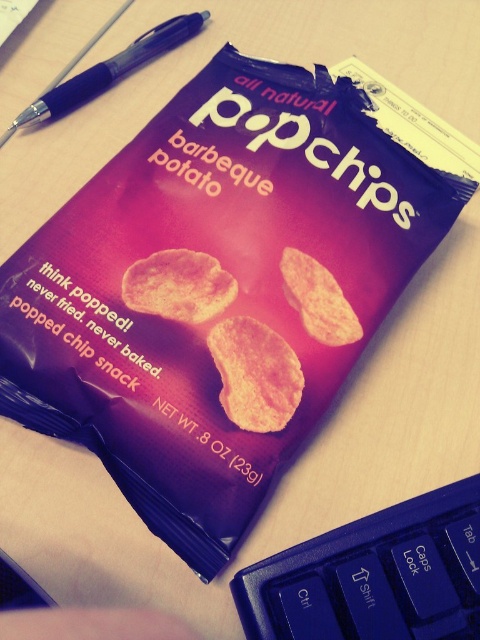
Question: Can you confirm if blue plastic keyboard at bottom right is bigger than black plastic pen at upper left?

Choices:
 (A) no
 (B) yes

Answer: (A)

Question: Is matte orange chip at center wider than black plastic pen at upper left?

Choices:
 (A) yes
 (B) no

Answer: (B)

Question: Is blue plastic keyboard at bottom right wider than matte orange popchip at center?

Choices:
 (A) yes
 (B) no

Answer: (A)

Question: Based on their relative distances, which object is nearer to the matte orange popchip at center?

Choices:
 (A) yellow matte popchip at center
 (B) black plastic pen at upper left
 (C) blue plastic keyboard at bottom right
 (D) matte orange chip at center

Answer: (A)

Question: Among these points, which one is farthest from the camera?

Choices:
 (A) (48, 92)
 (B) (308, 294)
 (C) (251, 424)

Answer: (A)

Question: Considering the real-world distances, which object is farthest from the black plastic pen at upper left?

Choices:
 (A) matte orange popchip at center
 (B) matte orange chip at center
 (C) yellow matte popchip at center

Answer: (C)